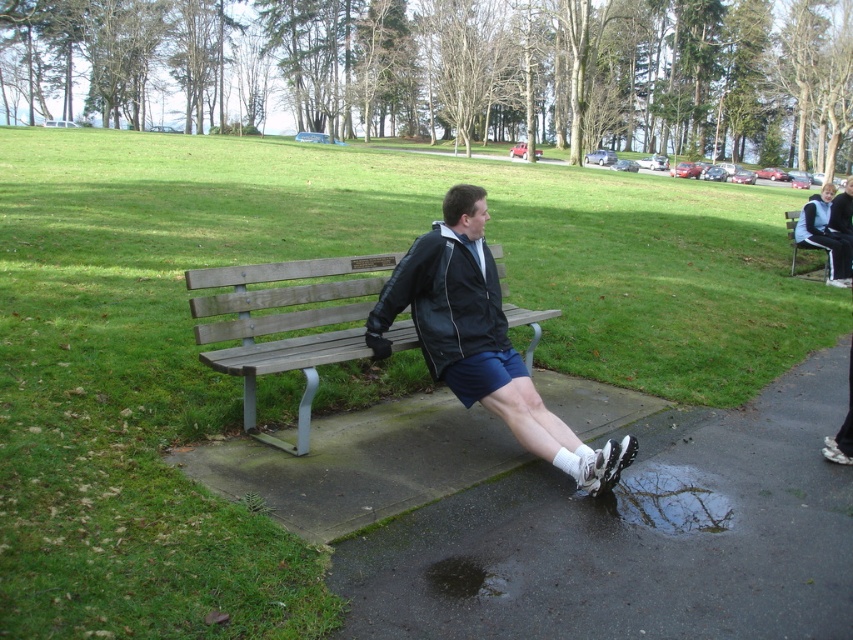
Question: Based on their relative distances, which object is nearer to the black leather jacket at upper right?

Choices:
 (A) black leather jacket at center
 (B) wooden bench at right
 (C) wooden bench at center

Answer: (B)

Question: Which point appears closest to the camera in this image?

Choices:
 (A) (x=804, y=236)
 (B) (x=824, y=266)
 (C) (x=503, y=326)
 (D) (x=206, y=307)

Answer: (D)

Question: Can you confirm if black leather jacket at center is smaller than wooden bench at center?

Choices:
 (A) yes
 (B) no

Answer: (A)

Question: In this image, where is black leather jacket at center located relative to black leather jacket at upper right?

Choices:
 (A) below
 (B) above

Answer: (A)

Question: Is wooden bench at center smaller than black leather jacket at upper right?

Choices:
 (A) yes
 (B) no

Answer: (B)

Question: Estimate the real-world distances between objects in this image. Which object is closer to the wooden bench at center?

Choices:
 (A) wooden bench at right
 (B) black leather jacket at center

Answer: (B)